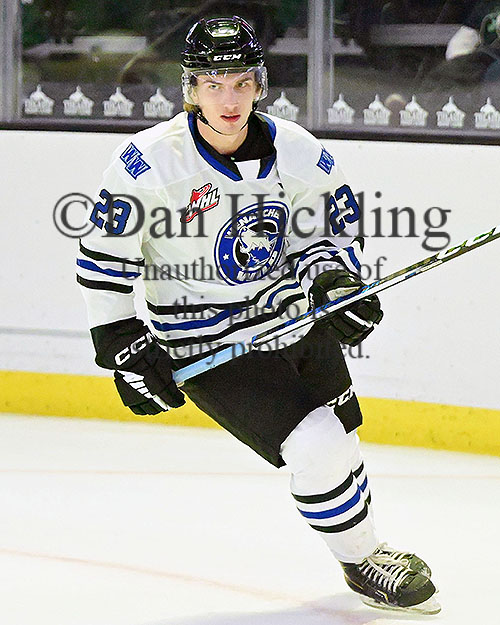
Find the location of a particular element. sideboard is located at coordinates (34, 239).